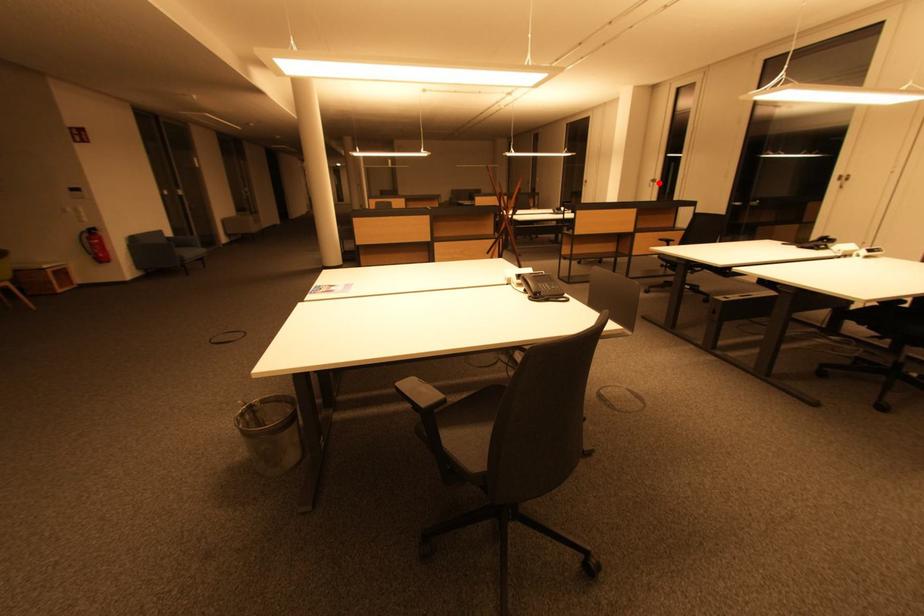
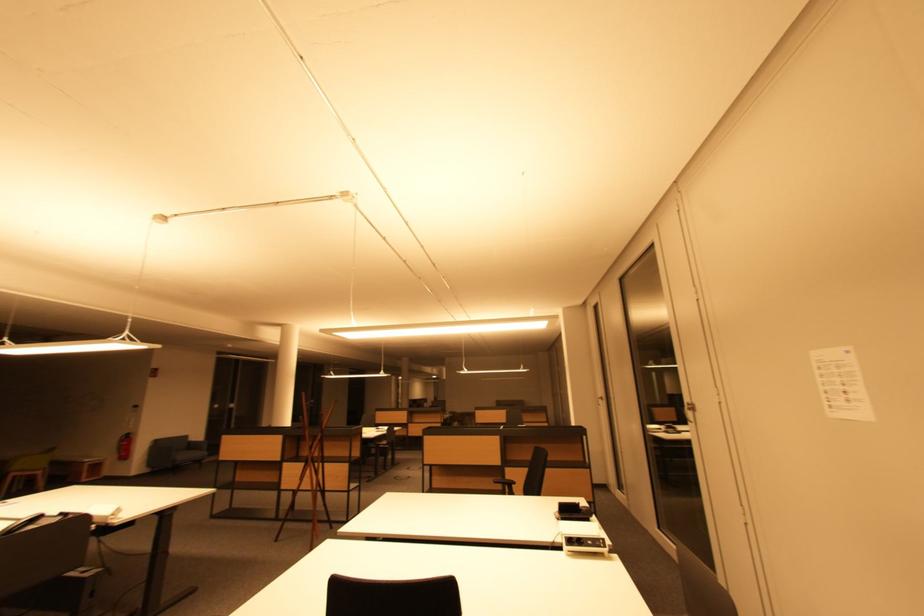
Question: I am providing you with two images of the same scene from different viewpoints. In image1, a red point is highlighted. Considering the same 3D point in image2, which of the following is correct?

Choices:
 (A) It is closer
 (B) It is farther

Answer: (B)